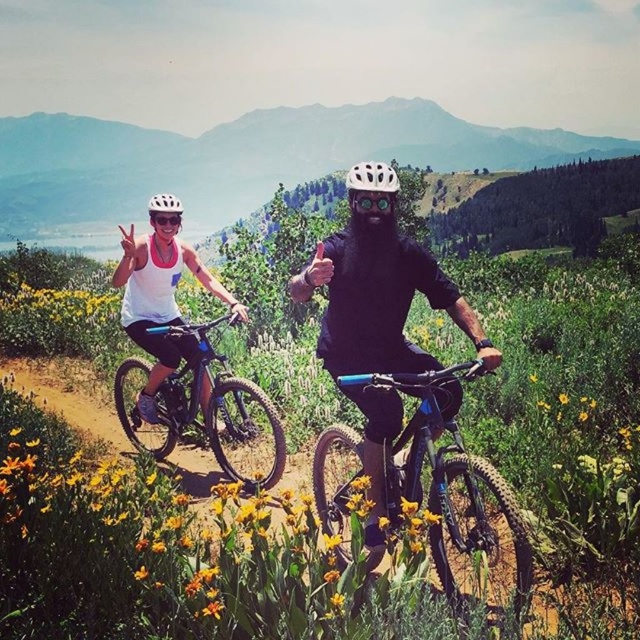
You are planning to take a photo of the matte black bike at left and the white matte helmet at upper center. Which object should you focus on first if you want to capture both in the same frame without moving the camera?

You should focus on the matte black bike at left first because it is closer to the camera than the white matte helmet at upper center, allowing both to be in the same frame.

You are a photographer positioned at the starting point of the trail. You want to capture a photo of the white matte helmet at upper center and the matte black bike at left in the same frame. Based on their positions, which object will appear closer to the camera in the photo?

The matte black bike at left will appear closer to the camera in the photo because the white matte helmet at upper center is positioned behind it.